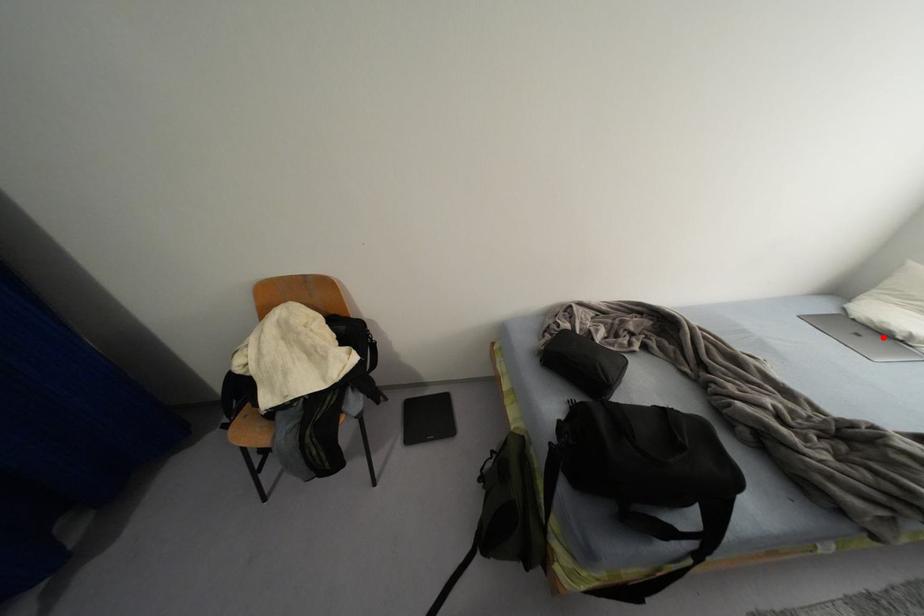
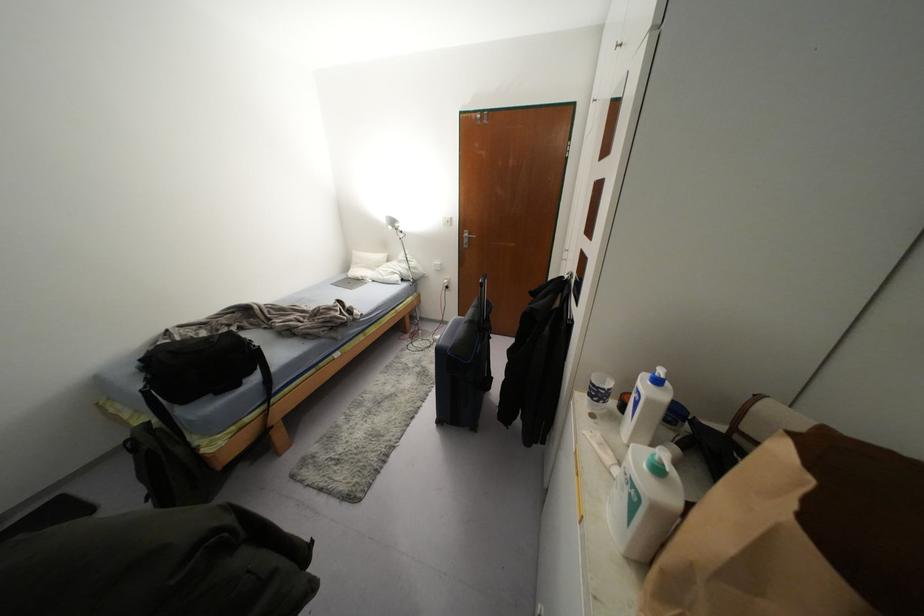
The point at the highlighted location is marked in the first image. Where is the corresponding point in the second image?

(358, 281)